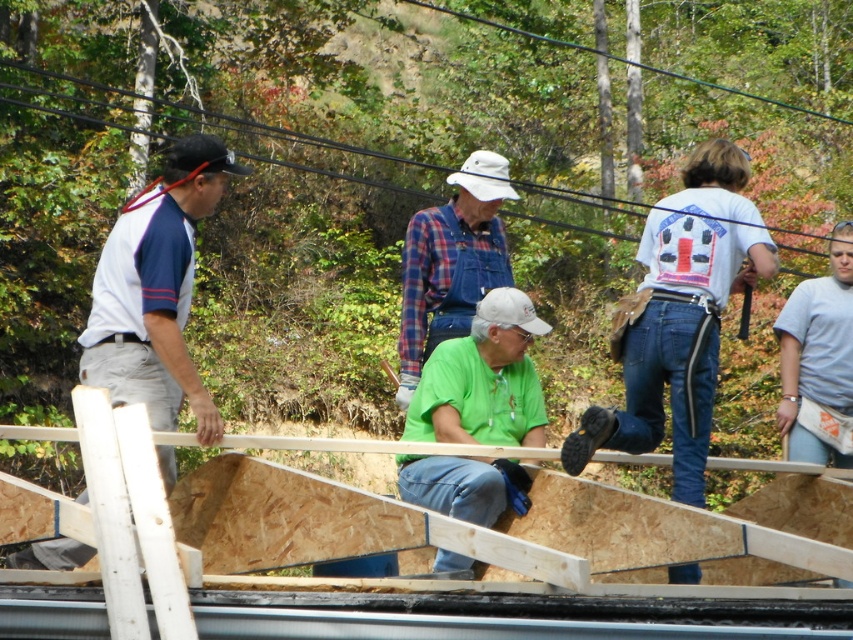
You are standing at the origin point of the image. Which object is located at the coordinates point (x=155, y=291)?

The white fabric shirt at left is located at point (x=155, y=291).

You are a construction worker standing at the edge of the construction site. You need to locate the green matte shirt at center quickly. Where should you look relative to your current position?

You should look towards the center of the scene, specifically at the coordinates point (483, 380), to locate the green matte shirt at center.

You are standing in the construction area and need to communicate with the person wearing the green matte shirt at center. Given that the average human voice can carry up to 10 meters without amplification, will you be able to hear them clearly without shouting?

The distance between you and the green matte shirt at center is 11.61 meters, which exceeds the 10 meter range of an average human voice. Therefore, you will not be able to hear them clearly without shouting.